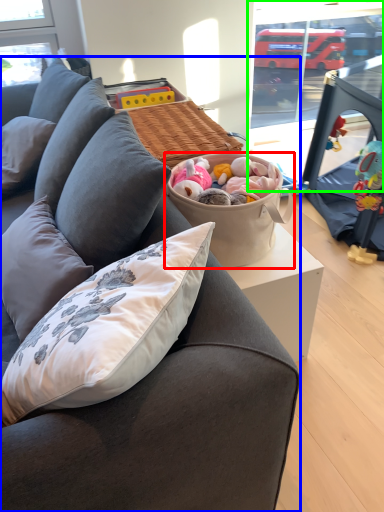
Question: Which is farther away from picnic basket (highlighted by a red box)? studio couch (highlighted by a blue box) or window screen (highlighted by a green box)?

Choices:
 (A) studio couch
 (B) window screen

Answer: (B)